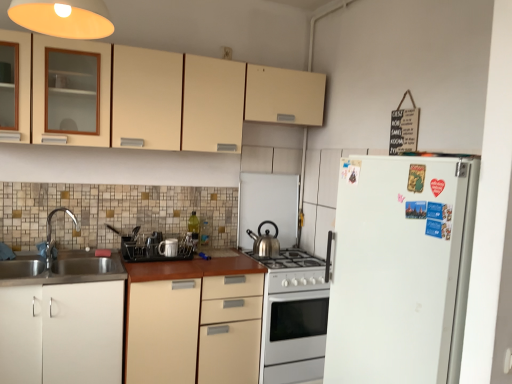
Question: Is matte black dish rack at center, positioned as the first appliance in left-to-right order, directly adjacent to matte cream cabinets at upper center, which is the third cabinetry in bottom-to-top order?

Choices:
 (A) no
 (B) yes

Answer: (A)

Question: Can you confirm if matte black dish rack at center, positioned as the first appliance in left-to-right order, is shorter than matte cream cabinets at upper center, which is the third cabinetry in bottom-to-top order?

Choices:
 (A) no
 (B) yes

Answer: (B)

Question: Considering the relative sizes of matte black dish rack at center, positioned as the first appliance in left-to-right order, and matte cream cabinets at upper center, the 1th cabinetry in the top-to-bottom sequence, in the image provided, is matte black dish rack at center, positioned as the first appliance in left-to-right order, wider than matte cream cabinets at upper center, the 1th cabinetry in the top-to-bottom sequence,?

Choices:
 (A) yes
 (B) no

Answer: (B)

Question: Is matte black dish rack at center, positioned as the 4th appliance in right-to-left order, looking in the opposite direction of matte cream cabinets at upper center, the 1th cabinetry in the top-to-bottom sequence?

Choices:
 (A) no
 (B) yes

Answer: (A)

Question: Can you confirm if matte black dish rack at center, positioned as the first appliance in left-to-right order, is thinner than matte cream cabinets at upper center, which is the third cabinetry in bottom-to-top order?

Choices:
 (A) no
 (B) yes

Answer: (B)

Question: In the image, is matte black dish rack at center, positioned as the 4th appliance in right-to-left order, on the left side or the right side of white glossy oven at center?

Choices:
 (A) right
 (B) left

Answer: (B)

Question: From a real-world perspective, is matte black dish rack at center, positioned as the 4th appliance in right-to-left order, positioned above or below white glossy oven at center?

Choices:
 (A) above
 (B) below

Answer: (A)

Question: Is matte black dish rack at center, positioned as the 4th appliance in right-to-left order, wider or thinner than white glossy oven at center?

Choices:
 (A) thin
 (B) wide

Answer: (A)

Question: Does point (151, 241) appear closer or farther from the camera than point (291, 297)?

Choices:
 (A) farther
 (B) closer

Answer: (A)

Question: From the image's perspective, is white ceramic mug at center, the third appliance positioned from the left, located above or below satin silver kettle at center, arranged as the 1th appliance when viewed from the right?

Choices:
 (A) below
 (B) above

Answer: (A)

Question: Does point (161, 241) appear closer or farther from the camera than point (253, 206)?

Choices:
 (A) farther
 (B) closer

Answer: (B)

Question: Is white ceramic mug at center, which is counted as the 2th appliance, starting from the right, bigger or smaller than satin silver kettle at center, positioned as the 4th appliance in left-to-right order?

Choices:
 (A) small
 (B) big

Answer: (A)

Question: Considering the positions of white ceramic mug at center, the third appliance positioned from the left, and satin silver kettle at center, arranged as the 1th appliance when viewed from the right, in the image, is white ceramic mug at center, the third appliance positioned from the left, taller or shorter than satin silver kettle at center, arranged as the 1th appliance when viewed from the right,?

Choices:
 (A) short
 (B) tall

Answer: (A)

Question: Based on their positions, is brushed metal faucet at left located to the left or right of matte black dish rack at center, positioned as the first appliance in left-to-right order?

Choices:
 (A) left
 (B) right

Answer: (A)

Question: From a real-world perspective, is brushed metal faucet at left above or below matte black dish rack at center, positioned as the 4th appliance in right-to-left order?

Choices:
 (A) above
 (B) below

Answer: (A)